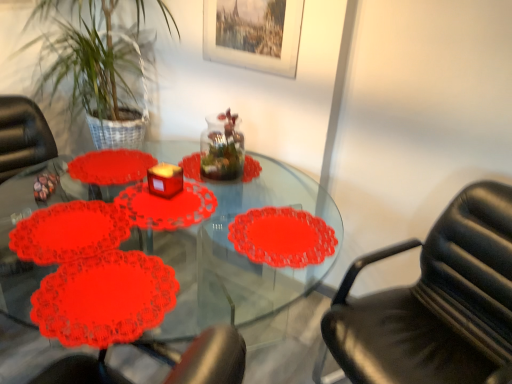
You are a GUI agent. You are given a task and a screenshot of the screen. Output one action in this format:
    pyautogui.click(x=<x>, y=<y>)
    Task: Click on the empty space that is to the right of matte red candle at center
    
    Given the screenshot: What is the action you would take?
    pyautogui.click(x=198, y=196)